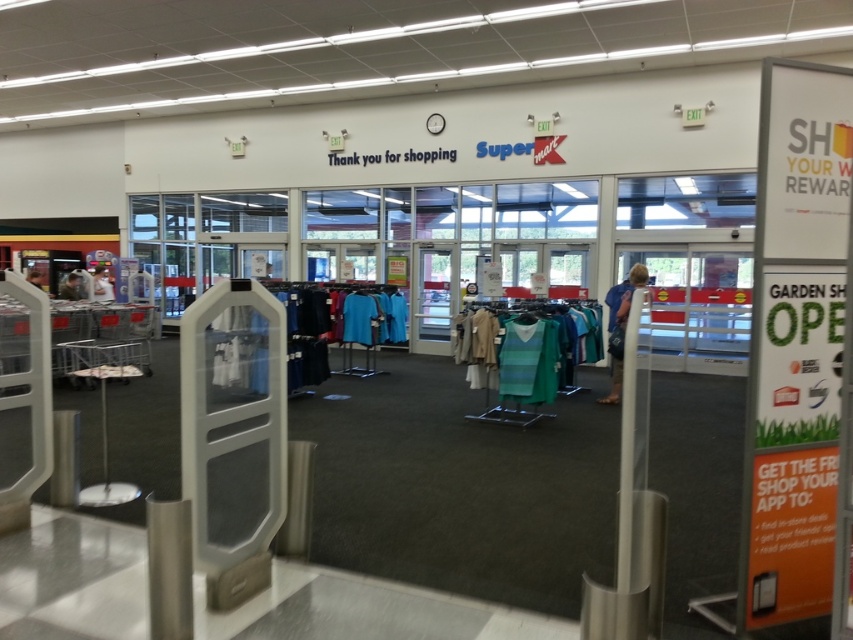
Question: Can you confirm if blue denim jeans at center is bigger than blue fabric dress at center?

Choices:
 (A) no
 (B) yes

Answer: (B)

Question: Is green knitted sweater at center to the right of blue denim jeans at center from the viewer's perspective?

Choices:
 (A) no
 (B) yes

Answer: (A)

Question: Is striped knit sweater at center above green knitted sweater at center?

Choices:
 (A) yes
 (B) no

Answer: (A)

Question: Among these objects, which one is nearest to the camera?

Choices:
 (A) striped knit sweater at center
 (B) green knitted sweater at center

Answer: (B)

Question: Which point is farther to the camera?

Choices:
 (A) (633, 266)
 (B) (514, 355)
 (C) (564, 317)
 (D) (616, 298)

Answer: (A)

Question: Which of the following is the closest to the observer?

Choices:
 (A) (613, 305)
 (B) (624, 292)
 (C) (544, 333)
 (D) (538, 348)

Answer: (D)